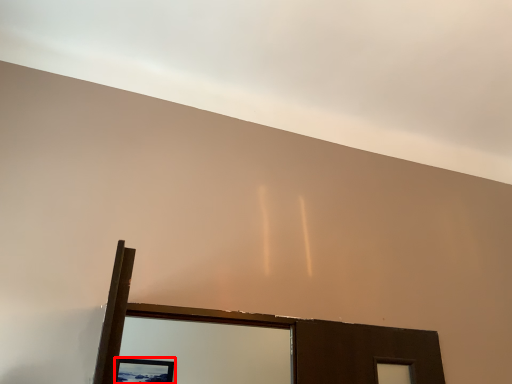
Question: From the image, what is the correct spatial relationship of picture frame (annotated by the red box) in relation to cloud?

Choices:
 (A) right
 (B) left

Answer: (B)